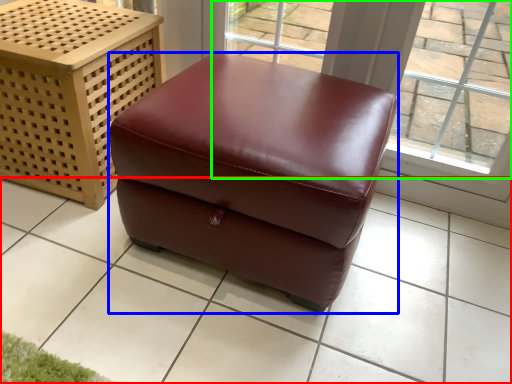
Question: Considering the real-world distances, which object is closest to tile (highlighted by a red box)? furniture (highlighted by a blue box) or window (highlighted by a green box).

Choices:
 (A) furniture
 (B) window

Answer: (A)